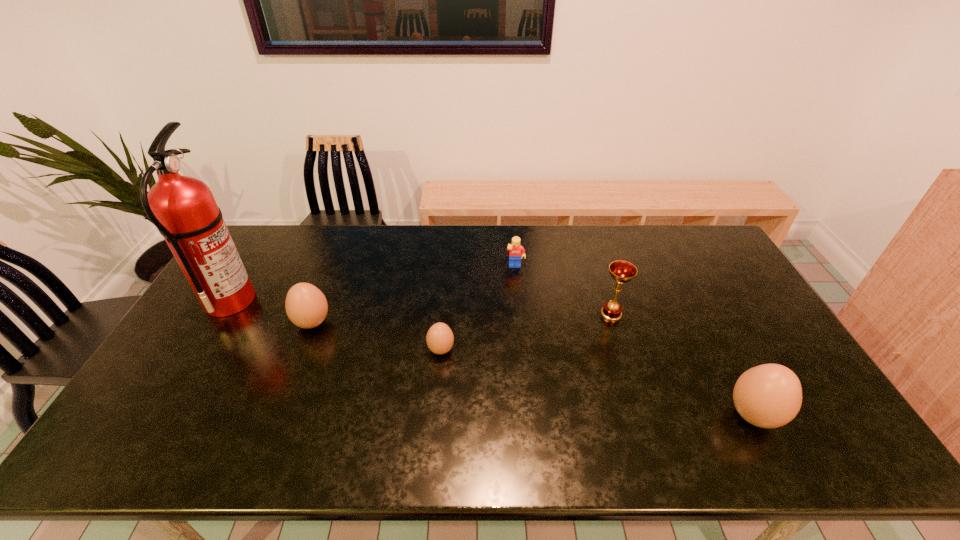
Find the location of a particular element. fire extinguisher is located at coordinates (183, 208).

The height and width of the screenshot is (540, 960). I want to click on vacant area situated on the left of the second shortest boiled egg, so click(244, 323).

You are a GUI agent. You are given a task and a screenshot of the screen. Output one action in this format:
    pyautogui.click(x=<x>, y=<y>)
    Task: Click on the free space located 0.360m on the left of the shortest object
    This screenshot has width=960, height=540.
    Given the screenshot: What is the action you would take?
    pyautogui.click(x=300, y=350)

Image resolution: width=960 pixels, height=540 pixels. I want to click on free region located 0.170m on the back of the nearest object, so click(x=715, y=342).

Locate an element on the screen. Image resolution: width=960 pixels, height=540 pixels. free space located on the face of the second shortest object is located at coordinates (518, 300).

Locate an element on the screen. The image size is (960, 540). vacant area situated on the back of the chalice is located at coordinates (589, 244).

Locate an element on the screen. vacant point located 0.250m at the nozzle of the leftmost object is located at coordinates (333, 301).

Locate an element on the screen. The width and height of the screenshot is (960, 540). object present at the far edge is located at coordinates (515, 249).

Find the location of a particular element. object at the near edge is located at coordinates (769, 396).

At what (x,y) coordinates should I click in order to perform the action: click on object that is at the left edge. Please return your answer as a coordinate pair (x, y). Image resolution: width=960 pixels, height=540 pixels. Looking at the image, I should click on (183, 208).